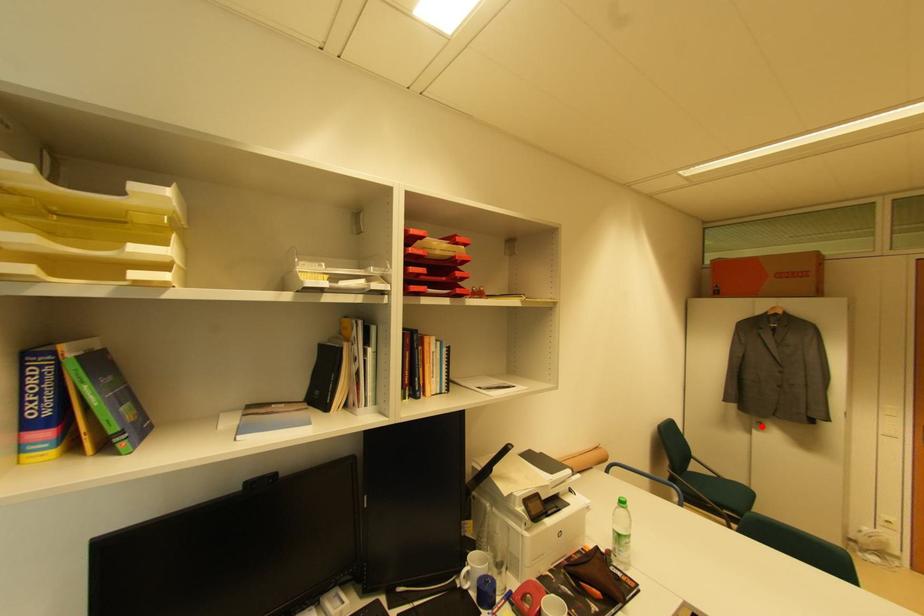
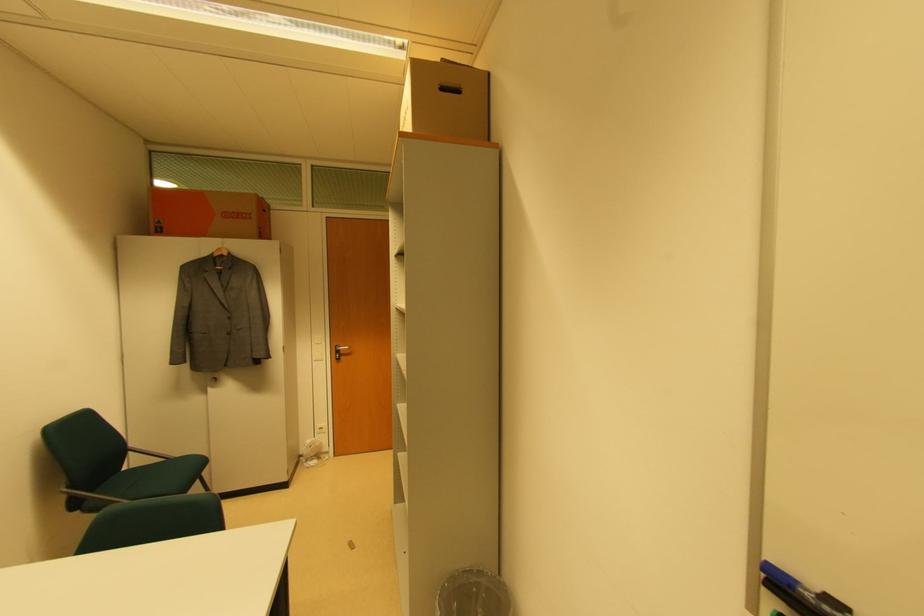
Question: I am providing you with two images of the same scene from different viewpoints. Image1 has a red point marked. In image2, the corresponding 3D location appears at what relative position? Reply with the corresponding letter.

Choices:
 (A) Closer
 (B) Farther

Answer: (B)